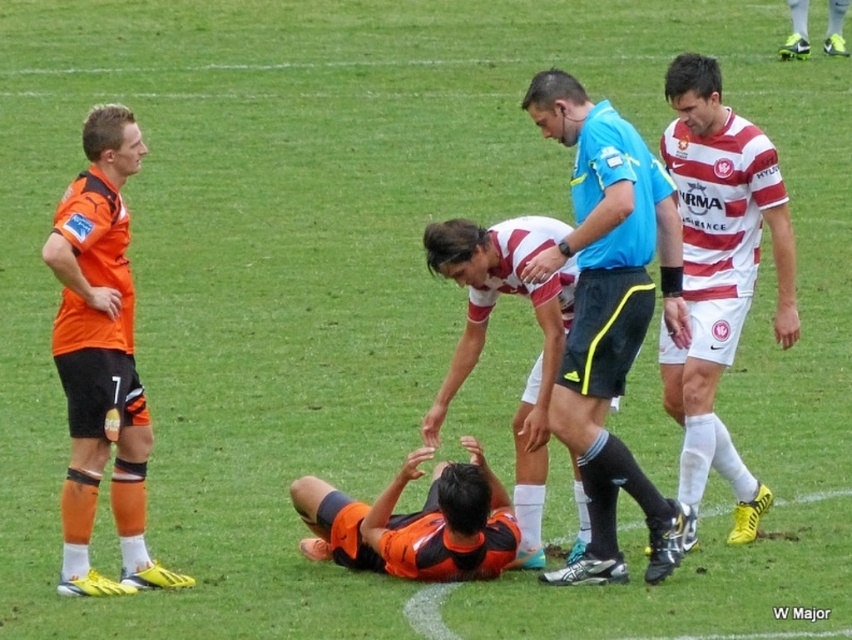
Question: Can you confirm if orange matte shorts at left is wider than white striped jersey at center?

Choices:
 (A) yes
 (B) no

Answer: (B)

Question: Based on their relative distances, which object is nearer to the white striped jersey at center?

Choices:
 (A) orange matte shorts at left
 (B) orange jersey at center
 (C) blue short-sleeved shirt at center
 (D) striped jersey at right

Answer: (C)

Question: Does white striped jersey at center appear on the right side of orange jersey at center?

Choices:
 (A) no
 (B) yes

Answer: (B)

Question: Estimate the real-world distances between objects in this image. Which object is closer to the striped jersey at right?

Choices:
 (A) blue short-sleeved shirt at center
 (B) white striped jersey at center

Answer: (A)

Question: Does blue short-sleeved shirt at center have a greater width compared to orange jersey at center?

Choices:
 (A) no
 (B) yes

Answer: (A)

Question: Among these objects, which one is farthest from the camera?

Choices:
 (A) blue short-sleeved shirt at center
 (B) white striped jersey at center
 (C) orange jersey at center
 (D) striped jersey at right

Answer: (D)